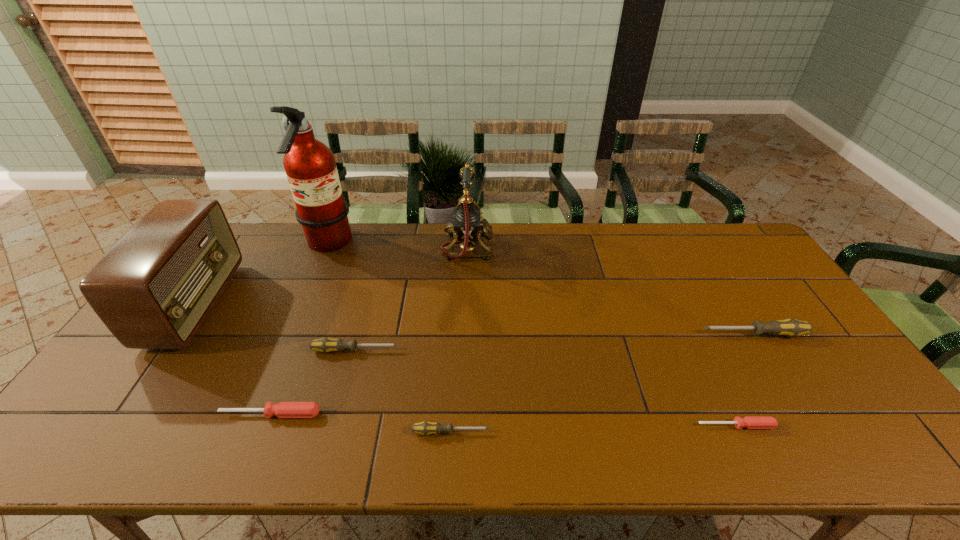
The height and width of the screenshot is (540, 960). In order to click on free area in between the fifth shortest object and the telephone in this screenshot , I will do `click(611, 291)`.

Identify the location of free area in between the tallest object and the shortest screwdriver. (532, 335).

Find the location of a particular element. This screenshot has height=540, width=960. empty space between the tallest screwdriver and the tallest object is located at coordinates (540, 290).

Where is `object identified as the fifth closest to the farthest screwdriver`? The width and height of the screenshot is (960, 540). object identified as the fifth closest to the farthest screwdriver is located at coordinates (284, 409).

The width and height of the screenshot is (960, 540). What are the coordinates of `object identified as the third closest to the fire extinguisher` in the screenshot? It's located at (325, 345).

Where is `screwdriver that is the fourth closest to the leftmost object`? screwdriver that is the fourth closest to the leftmost object is located at coordinates (750, 422).

Locate an element on the screen. This screenshot has height=540, width=960. screwdriver identified as the third closest to the fourth tallest object is located at coordinates click(325, 345).

Where is `the second closest gray screwdriver relative to the leftmost gray screwdriver`? the second closest gray screwdriver relative to the leftmost gray screwdriver is located at coordinates (790, 327).

This screenshot has width=960, height=540. Identify the location of the closest gray screwdriver to the nearest gray screwdriver. pos(325,345).

This screenshot has width=960, height=540. Find the location of `free space that satisfies the following two spatial constraints: 1. at the tip of the second tallest screwdriver; 2. on the back side of the shortest screwdriver`. free space that satisfies the following two spatial constraints: 1. at the tip of the second tallest screwdriver; 2. on the back side of the shortest screwdriver is located at coordinates (335, 426).